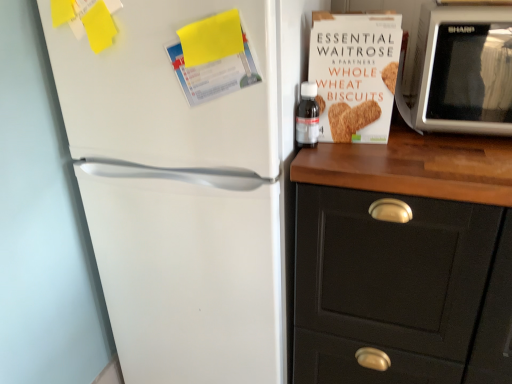
Question: In terms of width, does transparent plastic bottle at upper right look wider or thinner when compared to white cardboard box of whole wheat biscuits at upper right?

Choices:
 (A) wide
 (B) thin

Answer: (A)

Question: Considering the positions of transparent plastic bottle at upper right and white cardboard box of whole wheat biscuits at upper right in the image, is transparent plastic bottle at upper right bigger or smaller than white cardboard box of whole wheat biscuits at upper right?

Choices:
 (A) big
 (B) small

Answer: (B)

Question: Which object is positioned farthest from the white cardboard box of whole wheat biscuits at upper right?

Choices:
 (A) white plastic microwave at upper right
 (B) white matte refrigerator at left
 (C) black matte cabinet at right
 (D) transparent plastic bottle at upper right

Answer: (B)

Question: Estimate the real-world distances between objects in this image. Which object is closer to the white matte refrigerator at left?

Choices:
 (A) black matte cabinet at right
 (B) white plastic microwave at upper right
 (C) transparent plastic bottle at upper right
 (D) white cardboard box of whole wheat biscuits at upper right

Answer: (A)